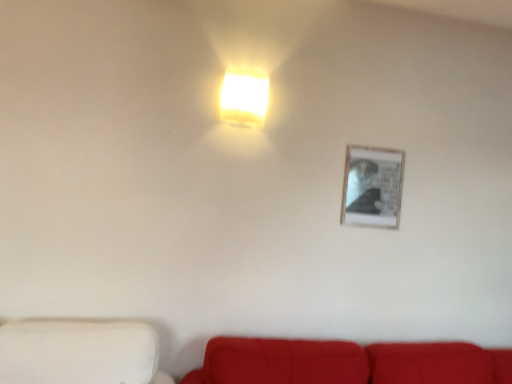
Measure the distance between point (420, 347) and camera.

Point (420, 347) and camera are 6.83 feet apart from each other.

Find the location of a particular element. The height and width of the screenshot is (384, 512). velvet red couch at lower center is located at coordinates (348, 363).

Identify the location of white matte wall at lower left. (79, 352).

Is matte white square at upper center next to white matte wall at lower left and touching it?

No, matte white square at upper center is not making contact with white matte wall at lower left.

From the image's perspective, which one is positioned lower, matte white square at upper center or white matte wall at lower left?

white matte wall at lower left.

Choose the correct answer: Is matte white square at upper center inside white matte wall at lower left or outside it?

matte white square at upper center is not inside white matte wall at lower left, it's outside.

Is velvet red couch at lower center wider than white matte wall at lower left?

Yes.

Considering the relative positions of velvet red couch at lower center and white matte wall at lower left in the image provided, is velvet red couch at lower center in front of white matte wall at lower left?

No, it is behind white matte wall at lower left.

Considering the sizes of velvet red couch at lower center and white matte wall at lower left in the image, is velvet red couch at lower center taller or shorter than white matte wall at lower left?

Considering their sizes, velvet red couch at lower center has more height than white matte wall at lower left.

Is matte white square at upper center not near velvet red couch at lower center?

matte white square at upper center is far away from velvet red couch at lower center.

Considering the sizes of matte white square at upper center and velvet red couch at lower center in the image, is matte white square at upper center bigger or smaller than velvet red couch at lower center?

In the image, matte white square at upper center appears to be smaller than velvet red couch at lower center.

Who is shorter, matte white square at upper center or velvet red couch at lower center?

Answer: matte white square at upper center is shorter.

Can we say matte white square at upper center lies outside velvet red couch at lower center?

Absolutely, matte white square at upper center is external to velvet red couch at lower center.

How different are the orientations of white matte wall at lower left and matte white square at upper center in degrees?

The angular difference between white matte wall at lower left and matte white square at upper center is 90.3 degrees.

Is the surface of white matte wall at lower left in direct contact with matte white square at upper center?

There is a gap between white matte wall at lower left and matte white square at upper center.

Considering the sizes of objects white matte wall at lower left and matte white square at upper center in the image provided, who is taller, white matte wall at lower left or matte white square at upper center?

With more height is matte white square at upper center.

Considering the sizes of objects white matte wall at lower left and matte white square at upper center in the image provided, who is thinner, white matte wall at lower left or matte white square at upper center?

With smaller width is matte white square at upper center.

You are a GUI agent. You are given a task and a screenshot of the screen. Output one action in this format:
    pyautogui.click(x=<x>, y=<y>)
    Task: Click on the lamp above the velvet red couch at lower center (from the image's perspective)
    The width and height of the screenshot is (512, 384).
    Given the screenshot: What is the action you would take?
    pyautogui.click(x=244, y=97)

Could you tell me if velvet red couch at lower center is turned towards matte white square at upper center?

No, velvet red couch at lower center is not aimed at matte white square at upper center.

Consider the image. From a real-world perspective, is velvet red couch at lower center on top of matte white square at upper center?

Actually, velvet red couch at lower center is physically below matte white square at upper center in the real world.

Is matte white square at upper center surrounded by velvet red couch at lower center?

No, velvet red couch at lower center does not contain matte white square at upper center.

Who is shorter, white matte wall at lower left or velvet red couch at lower center?

white matte wall at lower left is shorter.

Is white matte wall at lower left bigger than velvet red couch at lower center?

No.

From a real-world perspective, is white matte wall at lower left below velvet red couch at lower center?

Incorrect, from a real-world perspective, white matte wall at lower left is higher than velvet red couch at lower center.

From the image's perspective, is white matte wall at lower left under velvet red couch at lower center?

No, from the image's perspective, white matte wall at lower left is not beneath velvet red couch at lower center.

Where is `lamp behind the white matte wall at lower left`? lamp behind the white matte wall at lower left is located at coordinates (244, 97).

What are the coordinates of `furniture above the velvet red couch at lower center (from the image's perspective)` in the screenshot? It's located at (79, 352).

Estimate the real-world distances between objects in this image. Which object is further from velvet red couch at lower center, white matte wall at lower left or matte white square at upper center?

Among the two, matte white square at upper center is located further to velvet red couch at lower center.

Considering their positions, is matte white square at upper center positioned further to velvet red couch at lower center than white matte wall at lower left?

matte white square at upper center lies further to velvet red couch at lower center than the other object.

In the scene shown: Which object lies further to the anchor point matte white square at upper center, velvet red couch at lower center or white matte wall at lower left?

velvet red couch at lower center is further to matte white square at upper center.

From the image, which object appears to be farther from matte white square at upper center, white matte wall at lower left or velvet red couch at lower center?

velvet red couch at lower center lies further to matte white square at upper center than the other object.

Looking at the image, which one is located closer to white matte wall at lower left, velvet red couch at lower center or matte white square at upper center?

velvet red couch at lower center lies closer to white matte wall at lower left than the other object.

Considering their positions, is matte white square at upper center positioned closer to white matte wall at lower left than velvet red couch at lower center?

velvet red couch at lower center lies closer to white matte wall at lower left than the other object.

In order to click on furniture between matte white square at upper center and velvet red couch at lower center from top to bottom in this screenshot , I will do `click(79, 352)`.